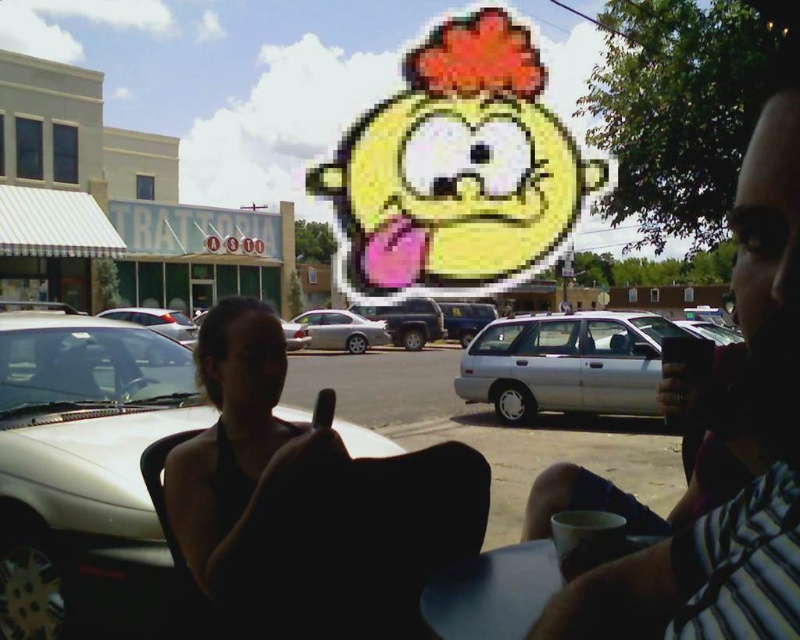
What object is located at the coordinates point (86, 474) in the image?

The point (86, 474) corresponds to the white matte car at left.

You are a delivery person who needs to place a small package on the table. Given the current setup, can you place the package on the blue matte table at lower center without moving the matte black phone at center?

The matte black phone at center is in front of the blue matte table at lower center, so the phone is blocking part of the table. Therefore, you can place the package on the blue matte table at lower center but need to ensure it doesn not interfere with the phone.